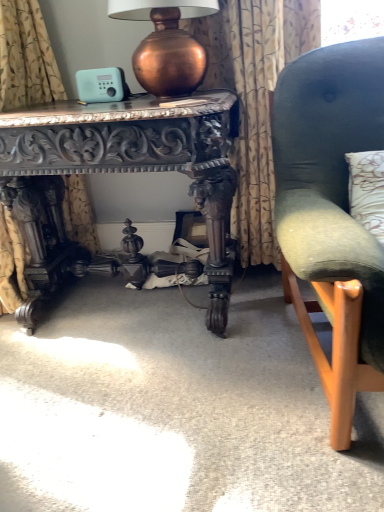
Question: From the image's perspective, is floral-patterned fabric at center, the 2th curtain positioned from the left, above or below velvet green chair at right?

Choices:
 (A) above
 (B) below

Answer: (A)

Question: Considering the positions of floral-patterned fabric at center, positioned as the 1th curtain in right-to-left order, and velvet green chair at right in the image, is floral-patterned fabric at center, positioned as the 1th curtain in right-to-left order, taller or shorter than velvet green chair at right?

Choices:
 (A) short
 (B) tall

Answer: (B)

Question: Which object is positioned farthest from the copper metallic table lamp at upper center?

Choices:
 (A) floral-patterned fabric at center, the 2th curtain positioned from the left
 (B) velvet green chair at right
 (C) dark wood carved table at center
 (D) gold floral fabric at left, the second curtain when ordered from right to left

Answer: (B)

Question: Which object is positioned closest to the gold floral fabric at left, which is the 1th curtain in left-to-right order?

Choices:
 (A) dark wood carved table at center
 (B) floral-patterned fabric at center, positioned as the 1th curtain in right-to-left order
 (C) copper metallic table lamp at upper center
 (D) velvet green chair at right

Answer: (C)